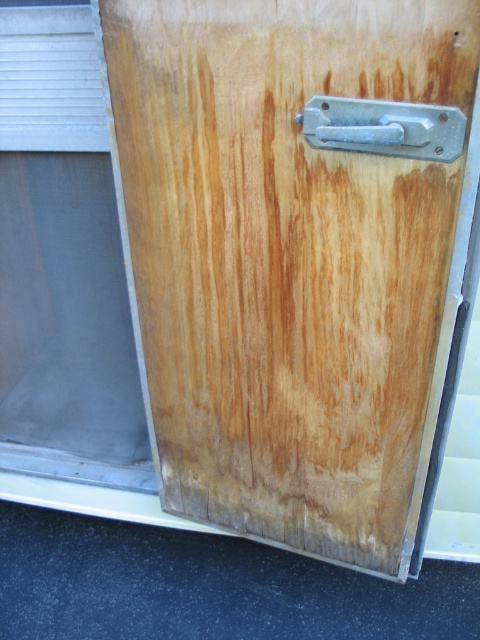
Looking at this image, you are examining a wooden door with two points marked on it. The first point is at coordinates point (240,33) and the second is at point (45,321). Which point is nearer to you?

Point (240,33) is closer to the viewer than point (45,321).

In the scene shown: You are trying to determine if the metallic silver door handle at upper center can be seen from the bottom edge of the natural wood door at center. Based on their heights, can the handle be visible from there?

The natural wood door at center has a greater height than the metallic silver door handle at upper center. Since the door is taller, the handle at the upper center would still be visible from the bottom edge as it is positioned higher up on the door.

You are trying to determine which object is larger between the transparent plastic window at upper left and the metallic silver door handle at upper center. Based on the scene, which one is larger?

The transparent plastic window at upper left is bigger than the metallic silver door handle at upper center according to the description.